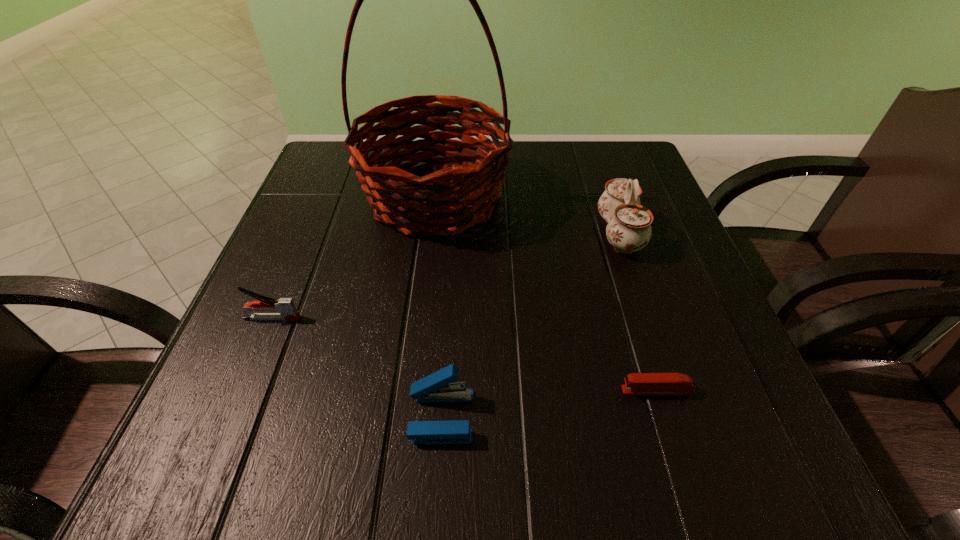
Where is `vacant region at the near right corner of the desktop`? The image size is (960, 540). vacant region at the near right corner of the desktop is located at coordinates (714, 491).

Where is `vacant region between the farthest stapler and the fourth shortest object`? The height and width of the screenshot is (540, 960). vacant region between the farthest stapler and the fourth shortest object is located at coordinates (445, 276).

Find the location of a particular element. free space between the second stapler from right to left and the tallest object is located at coordinates (438, 307).

Where is `free space that is in between the second stapler from right to left and the basket`? free space that is in between the second stapler from right to left and the basket is located at coordinates (438, 307).

What are the coordinates of `empty space that is in between the chinaware and the farthest stapler` in the screenshot? It's located at (445, 276).

Find the location of a particular element. The height and width of the screenshot is (540, 960). free spot between the rightmost stapler and the fourth shortest object is located at coordinates (637, 312).

Identify the location of free space between the chinaware and the second stapler from left to right. (530, 325).

The width and height of the screenshot is (960, 540). In order to click on vacant space in between the leftmost object and the chinaware in this screenshot , I will do `click(445, 276)`.

This screenshot has height=540, width=960. What are the coordinates of `unoccupied area between the leftmost object and the tallest object` in the screenshot? It's located at (353, 258).

Locate an element on the screen. unoccupied area between the third farthest object and the second stapler from right to left is located at coordinates (357, 367).